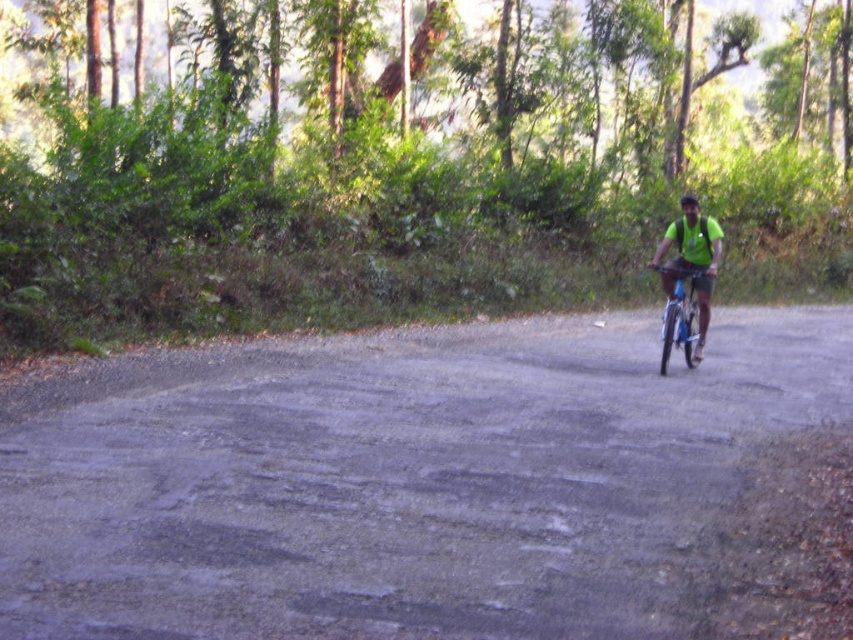
Question: Which object appears farthest from the camera in this image?

Choices:
 (A) green matte shirt at center
 (B) gray asphalt road at center

Answer: (A)

Question: Does gray asphalt road at center appear on the right side of black matte helmet at upper center?

Choices:
 (A) yes
 (B) no

Answer: (B)

Question: Among these objects, which one is farthest from the camera?

Choices:
 (A) gray asphalt road at center
 (B) black matte helmet at upper center
 (C) green matte shirt at center

Answer: (B)

Question: Does gray asphalt road at center have a larger size compared to black matte helmet at upper center?

Choices:
 (A) yes
 (B) no

Answer: (B)

Question: Which object is closer to the camera taking this photo?

Choices:
 (A) black matte helmet at upper center
 (B) green matte shirt at center

Answer: (B)

Question: Is gray asphalt road at center in front of black matte helmet at upper center?

Choices:
 (A) yes
 (B) no

Answer: (A)